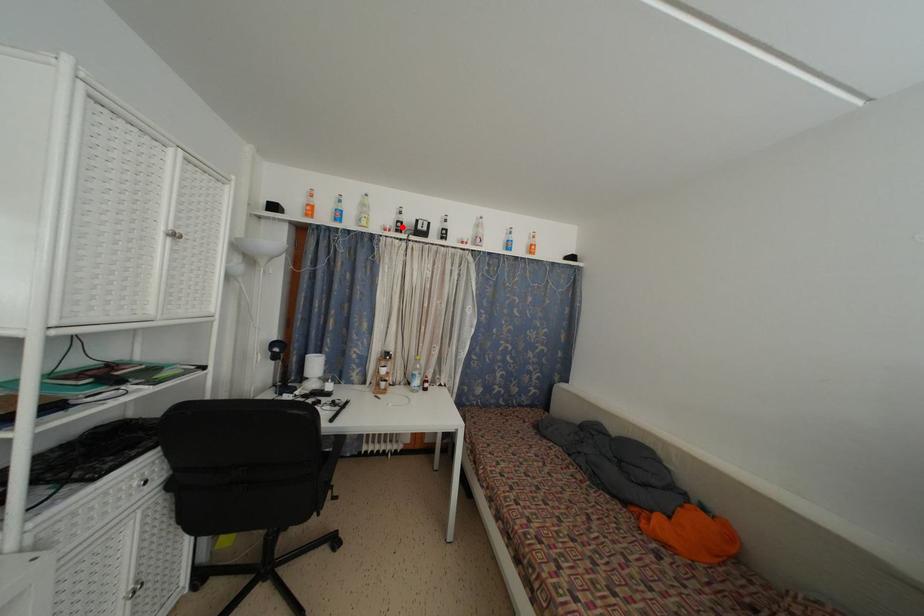
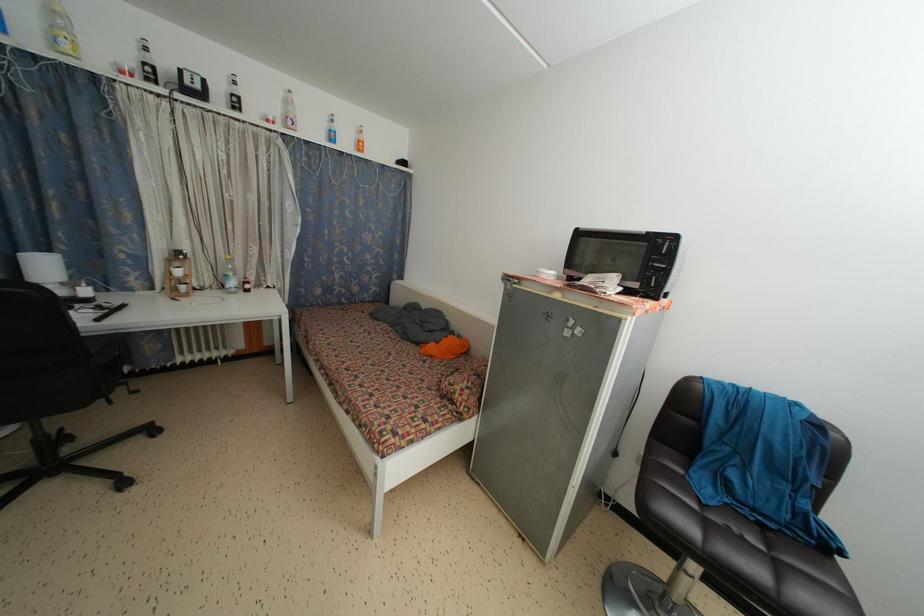
The point at the highlighted location is marked in the first image. Where is the corresponding point in the second image?

(149, 70)